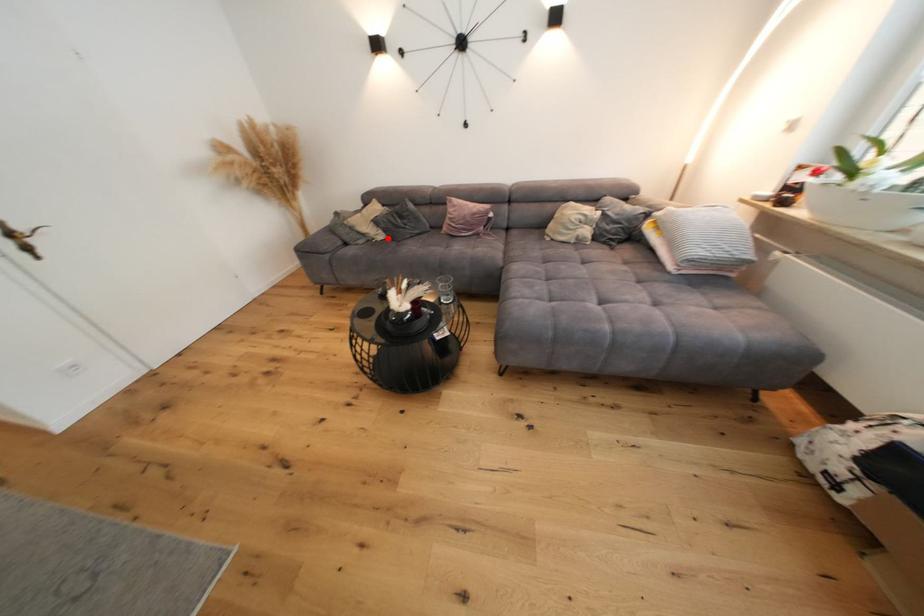
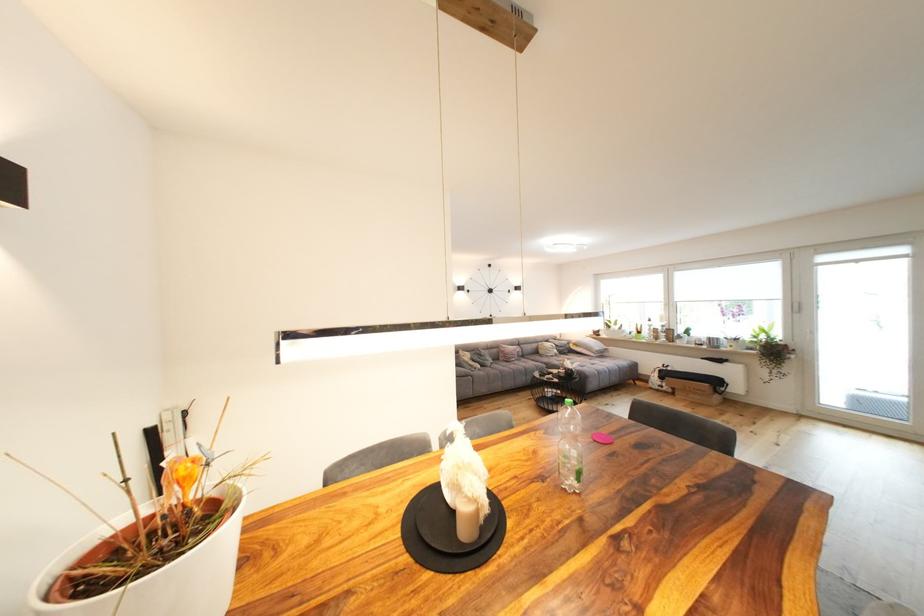
Question: I am providing you with two images of the same scene from different viewpoints. In image1, a red point is highlighted. Considering the same 3D point in image2, which of the following is correct?

Choices:
 (A) It is closer
 (B) It is farther

Answer: (B)